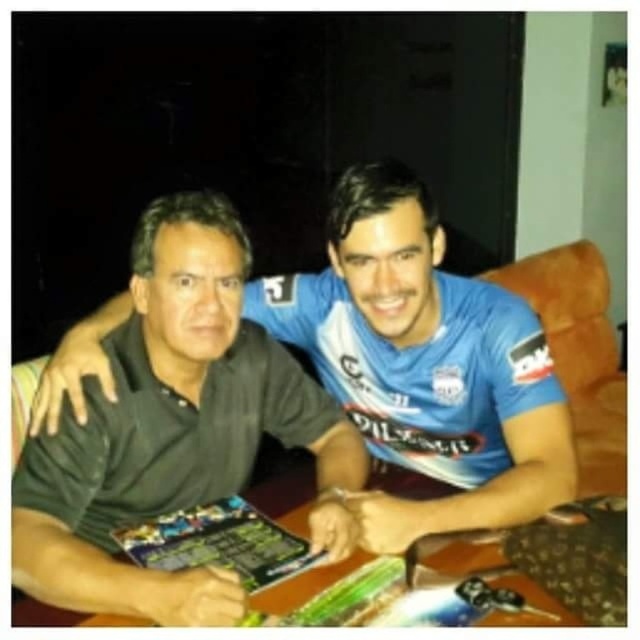
Is black matte shirt at center smaller than wooden table at center?

No.

Between black matte shirt at center and wooden table at center, which one appears on the left side from the viewer's perspective?

From the viewer's perspective, black matte shirt at center appears more on the left side.

I want to click on black matte shirt at center, so click(173, 429).